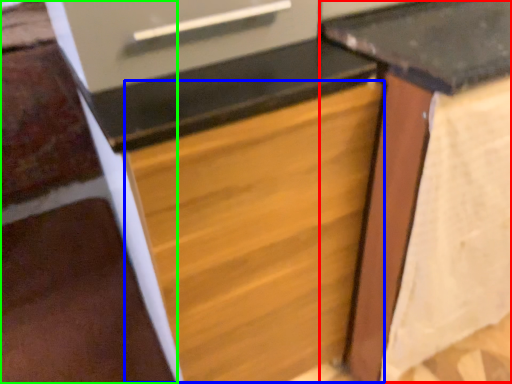
Question: Which object is positioned farthest from table (highlighted by a red box)? Select from drawer (highlighted by a blue box) and stairwell (highlighted by a green box).

Choices:
 (A) drawer
 (B) stairwell

Answer: (B)